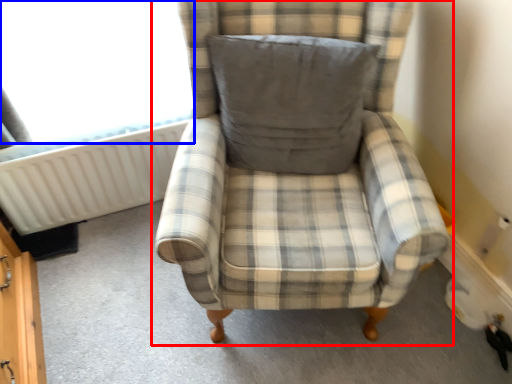
Question: Which object appears farthest to the camera in this image, chair (highlighted by a red box) or window screen (highlighted by a blue box)?

Choices:
 (A) chair
 (B) window screen

Answer: (B)